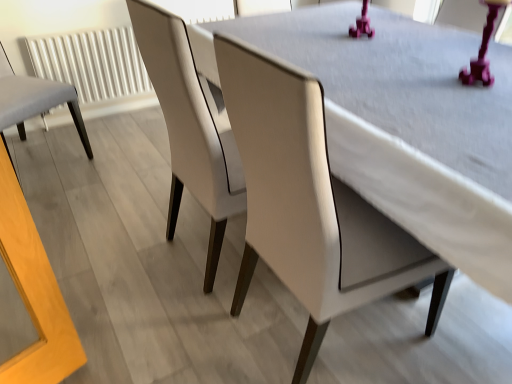
You are a GUI agent. You are given a task and a screenshot of the screen. Output one action in this format:
    pyautogui.click(x=<x>, y=<y>)
    Task: Click on the free space between light gray fabric chair at left, the 1th chair in the left-to-right sequence, and matte white chair at center, arranged as the 2th chair when viewed from the left
    
    Given the screenshot: What is the action you would take?
    pyautogui.click(x=110, y=208)